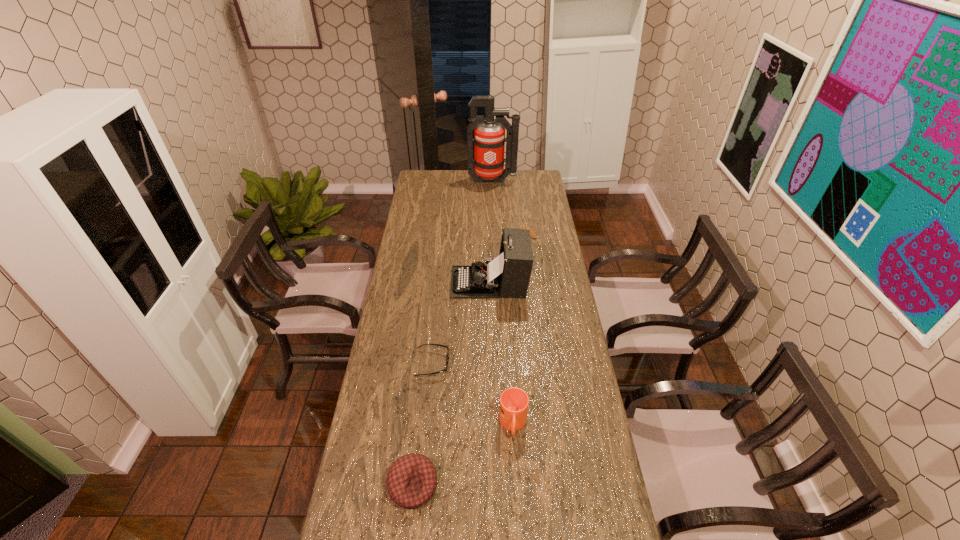
Where is `the shortest object`? The width and height of the screenshot is (960, 540). the shortest object is located at coordinates coord(447,362).

Locate an element on the screen. Image resolution: width=960 pixels, height=540 pixels. the third nearest object is located at coordinates (447, 362).

This screenshot has height=540, width=960. Find the location of `blank space located 0.110m on the front label side of the tallest object`. blank space located 0.110m on the front label side of the tallest object is located at coordinates (493, 199).

At what (x,y) coordinates should I click in order to perform the action: click on free space located 0.180m inside the open case of the typewriter. Please return your answer as a coordinate pair (x, y). The height and width of the screenshot is (540, 960). Looking at the image, I should click on (409, 282).

You are a GUI agent. You are given a task and a screenshot of the screen. Output one action in this format:
    pyautogui.click(x=<x>, y=<y>)
    Task: Click on the vacant space located 0.200m inside the open case of the typewriter
    This screenshot has height=540, width=960.
    Given the screenshot: What is the action you would take?
    pyautogui.click(x=404, y=282)

This screenshot has height=540, width=960. I want to click on free spot located inside the open case of the typewriter, so click(393, 282).

Locate an element on the screen. The image size is (960, 540). vacant space situated 0.210m on the handle side of the mug is located at coordinates pyautogui.click(x=518, y=517).

Find the location of `vacant space located 0.310m on the right of the beanbag`. vacant space located 0.310m on the right of the beanbag is located at coordinates (547, 485).

The image size is (960, 540). Find the location of `vacant space located 0.360m on the back of the fifth nearest object`. vacant space located 0.360m on the back of the fifth nearest object is located at coordinates (520, 192).

The image size is (960, 540). Identify the location of vacant position located on the front-facing side of the sunglasses. (522, 363).